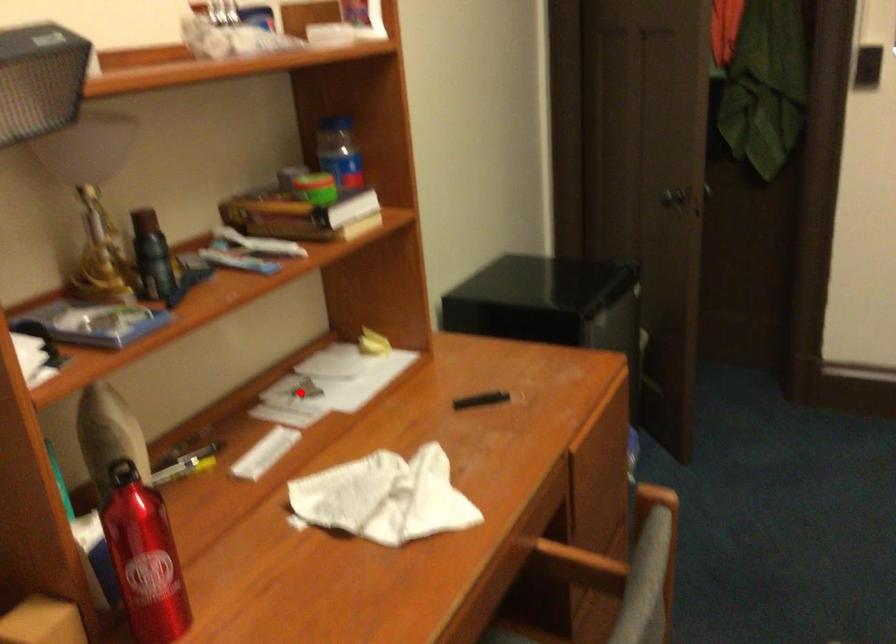
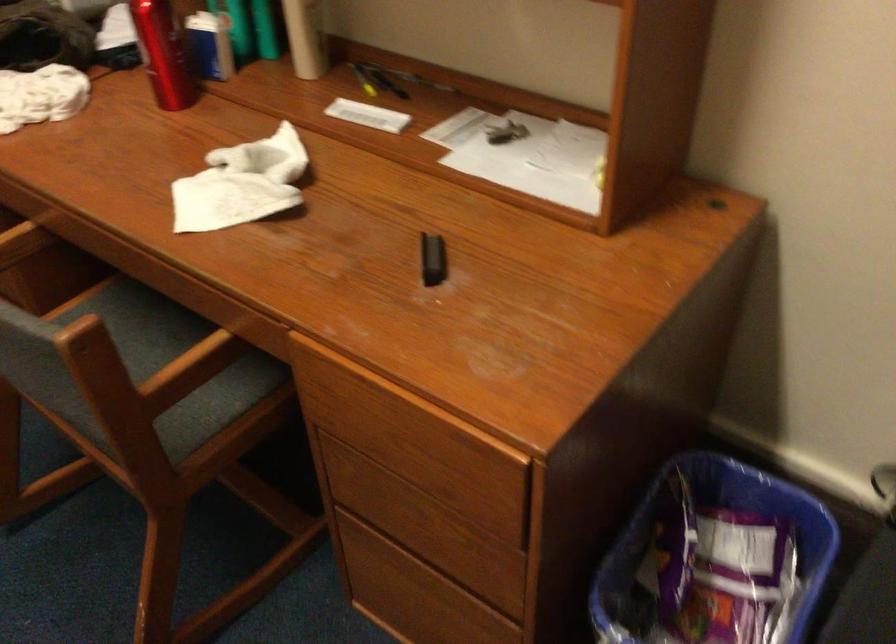
Where in the second image is the point corresponding to the highlighted location from the first image?

(504, 131)